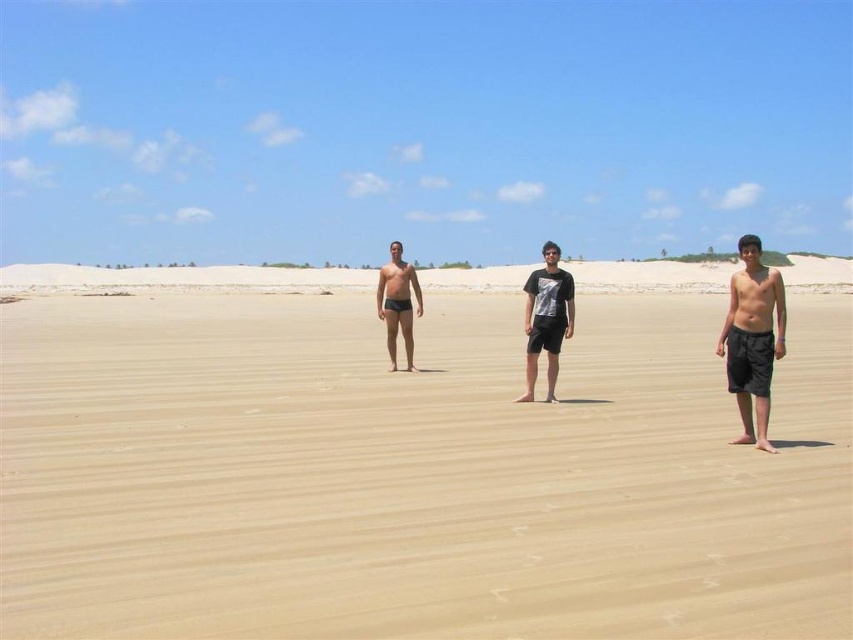
Question: Can you confirm if matte black shorts at center is thinner than matte black swim trunks at center?

Choices:
 (A) no
 (B) yes

Answer: (A)

Question: Which object appears farthest from the camera in this image?

Choices:
 (A) matte black shorts at center
 (B) silver metallic t-shirt at center
 (C) black matte shorts at right

Answer: (B)

Question: Considering the relative positions of black matte shorts at right and matte black swim trunks at center in the image provided, where is black matte shorts at right located with respect to matte black swim trunks at center?

Choices:
 (A) below
 (B) above

Answer: (A)

Question: In this image, where is smooth tan sand at center located relative to matte black swim trunks at center?

Choices:
 (A) right
 (B) left

Answer: (A)

Question: Estimate the real-world distances between objects in this image. Which object is farther from the matte black swim trunks at center?

Choices:
 (A) smooth tan sand at center
 (B) silver metallic t-shirt at center
 (C) black matte shorts at right

Answer: (C)

Question: Which of the following is the farthest from the observer?

Choices:
 (A) smooth tan sand at center
 (B) matte black swim trunks at center
 (C) silver metallic t-shirt at center
 (D) black matte shorts at right

Answer: (B)